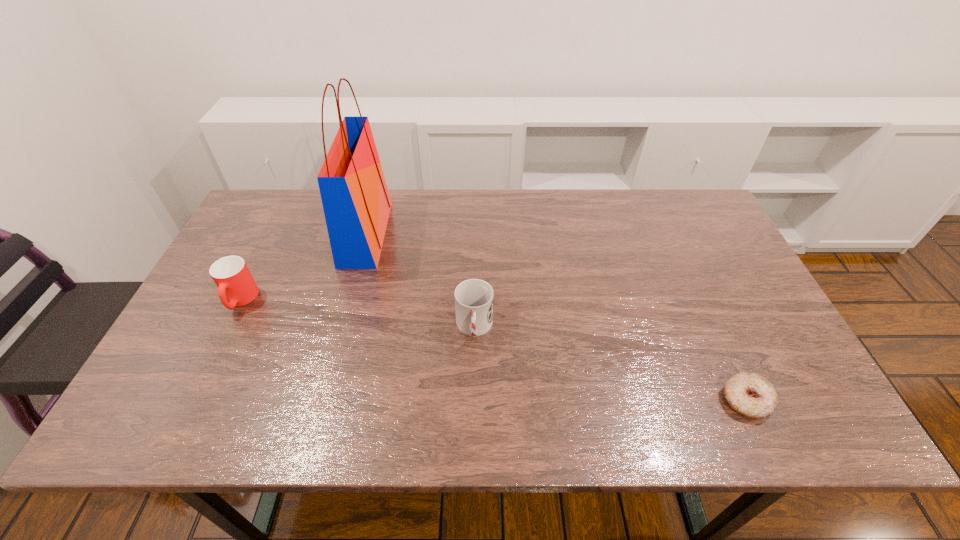
Locate an element on the screen. This screenshot has height=540, width=960. vacant space at the near left corner of the desktop is located at coordinates (212, 412).

Identify the location of free spot at the far right corner of the desktop. The width and height of the screenshot is (960, 540). (691, 222).

The height and width of the screenshot is (540, 960). What are the coordinates of `vacant space that's between the leftmost object and the second object from right to left` in the screenshot? It's located at (357, 314).

Identify the location of free space between the third object from left to right and the tallest object. (420, 281).

Locate an element on the screen. The image size is (960, 540). unoccupied area between the leftmost object and the rightmost object is located at coordinates (493, 350).

Where is `vacant area that lies between the left cup and the doughnut`? This screenshot has width=960, height=540. vacant area that lies between the left cup and the doughnut is located at coordinates (493, 350).

This screenshot has width=960, height=540. Identify the location of free spot between the left cup and the shortest object. (493, 350).

Where is `vacant area between the shortest object and the leftmost object`? This screenshot has height=540, width=960. vacant area between the shortest object and the leftmost object is located at coordinates (493, 350).

Image resolution: width=960 pixels, height=540 pixels. Identify the location of vacant point located between the second object from right to left and the leftmost object. click(x=357, y=314).

Locate an element on the screen. This screenshot has width=960, height=540. free space between the shortest object and the right cup is located at coordinates (611, 364).